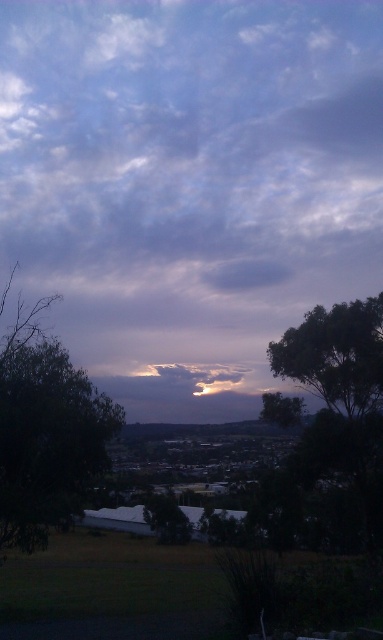
Who is lower down, dark green leafy tree at left or dark green leafy tree at right?

dark green leafy tree at left is lower down.

Based on the photo, how far apart are dark green leafy tree at left and dark green leafy tree at right?

dark green leafy tree at left is 59.38 feet away from dark green leafy tree at right.

Measure the distance between dark green leafy tree at left and camera.

The distance of dark green leafy tree at left from camera is 21.65 meters.

Locate an element on the screen. The width and height of the screenshot is (383, 640). dark green leafy tree at left is located at coordinates (45, 433).

Between cloudy sky at center and dark green leafy tree at left, which one is positioned higher?

cloudy sky at center

Which is behind, point (116, 266) or point (1, 349)?

The point (116, 266) is more distant.

Identify the location of cloudy sky at center. The height and width of the screenshot is (640, 383). (189, 182).

Who is lower down, green leafy tree at right or green leafy tree at center?

green leafy tree at center is below.

Between point (371, 316) and point (165, 509), which one is positioned in front?

Point (371, 316) is more forward.

Who is more distant from viewer, [360,394] or [150,496]?

The point [150,496] is behind.

Where is `green leafy tree at right`? This screenshot has height=640, width=383. green leafy tree at right is located at coordinates (340, 401).